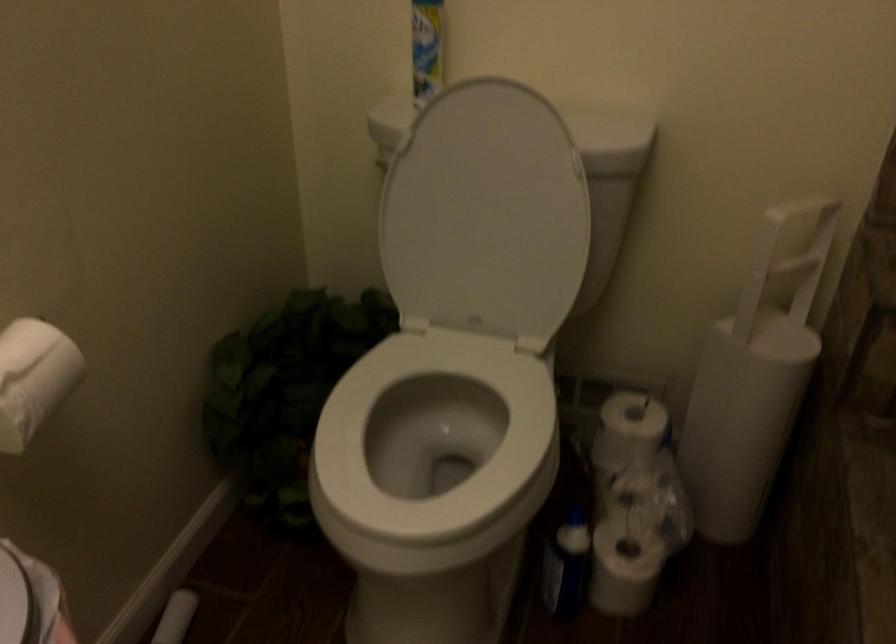
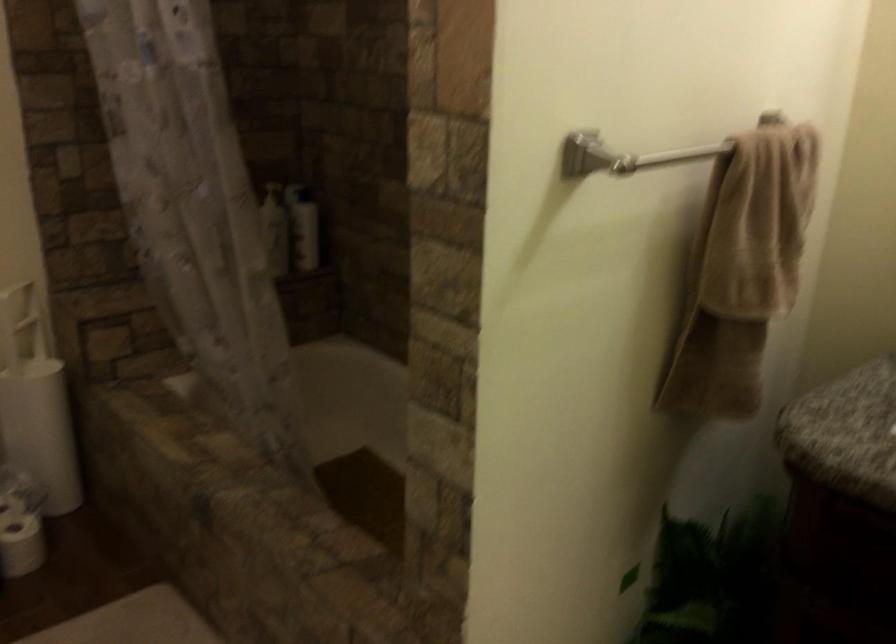
In the second image, find the point that corresponds to point 768,268 in the first image.

(20, 323)